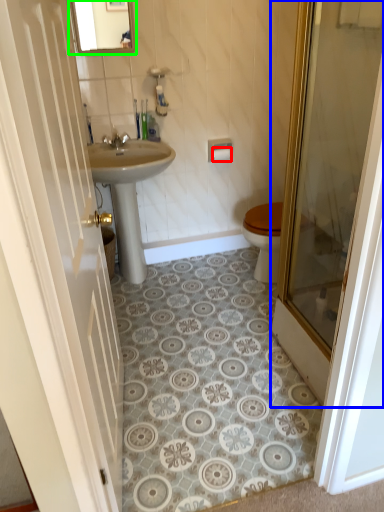
Question: Estimate the real-world distances between objects in this image. Which object is farther from toilet paper (highlighted by a red box), door (highlighted by a blue box) or mirror (highlighted by a green box)?

Choices:
 (A) door
 (B) mirror

Answer: (A)